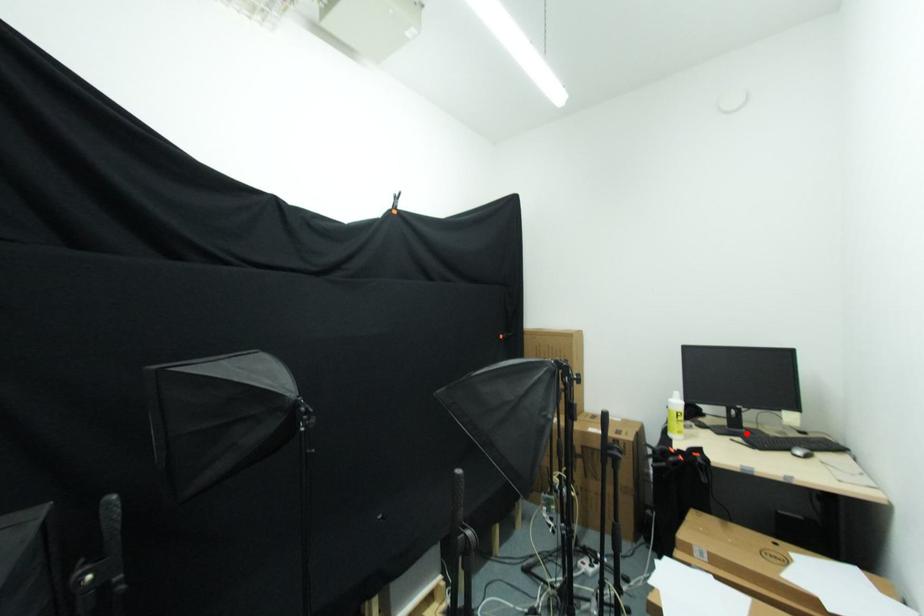
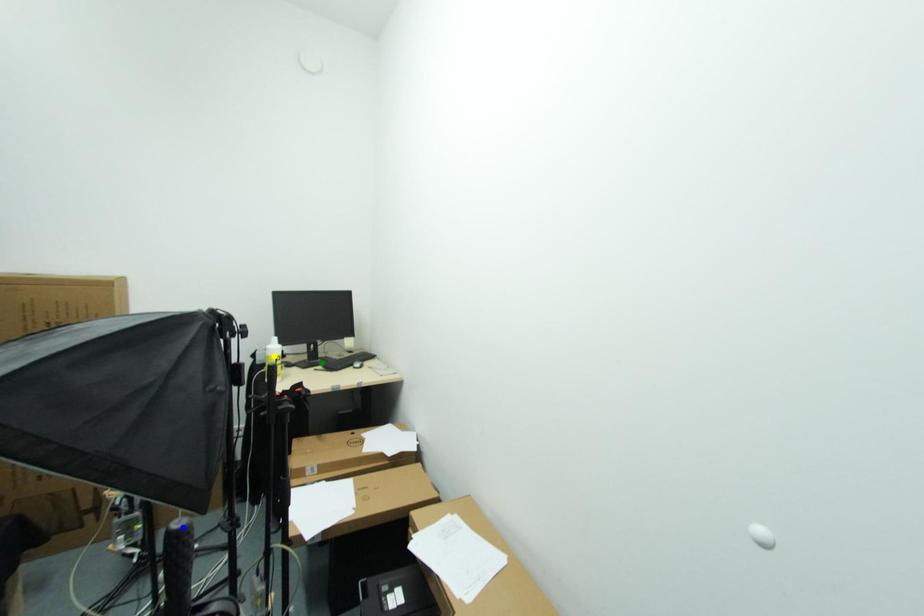
Question: I am providing you with two images of the same scene from different viewpoints. A red point is marked on the first image. You are given multiple points on the second image. Which point in image 2 represents the same 3d spot as the red point in image 1?

Choices:
 (A) blue point
 (B) green point
 (C) yellow point

Answer: (B)